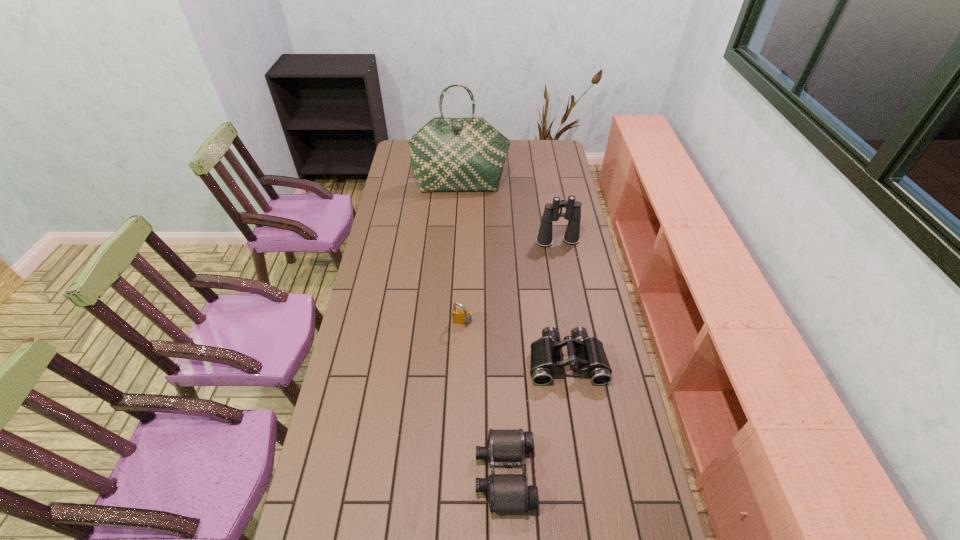
You are a GUI agent. You are given a task and a screenshot of the screen. Output one action in this format:
    pyautogui.click(x=<x>, y=<y>)
    Task: Click on the free region located 0.200m on the back of the farthest object
    
    Given the screenshot: What is the action you would take?
    pyautogui.click(x=463, y=158)

Locate an element on the screen. free region located on the front of the farthest binoculars is located at coordinates (568, 297).

Find the location of `vacant area situated 0.090m on the side with the combination dials of the third nearest object`. vacant area situated 0.090m on the side with the combination dials of the third nearest object is located at coordinates (462, 350).

You are a GUI agent. You are given a task and a screenshot of the screen. Output one action in this format:
    pyautogui.click(x=<x>, y=<y>)
    Task: Click on the blank space located 0.190m on the front-facing side of the second farthest binoculars
    
    Given the screenshot: What is the action you would take?
    pyautogui.click(x=580, y=443)

Image resolution: width=960 pixels, height=540 pixels. In order to click on free space located through the eyepieces of the leftmost binoculars in this screenshot , I will do `click(365, 473)`.

Find the location of a particular element. This screenshot has width=960, height=540. vacant space situated 0.210m through the eyepieces of the leftmost binoculars is located at coordinates (401, 473).

Locate an element on the screen. The width and height of the screenshot is (960, 540). vacant point located through the eyepieces of the leftmost binoculars is located at coordinates tap(422, 473).

You are a GUI agent. You are given a task and a screenshot of the screen. Output one action in this format:
    pyautogui.click(x=<x>, y=<y>)
    Task: Click on the object present at the left edge
    The width and height of the screenshot is (960, 540).
    Given the screenshot: What is the action you would take?
    pyautogui.click(x=447, y=154)

Where is `free space at the far edge of the desktop`? The height and width of the screenshot is (540, 960). free space at the far edge of the desktop is located at coordinates (x=508, y=158).

Where is `blank area at the left edge`? This screenshot has width=960, height=540. blank area at the left edge is located at coordinates (414, 182).